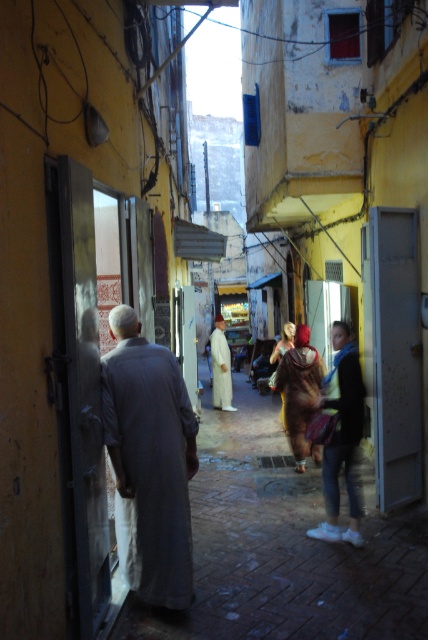
Is gray cotton robe at left taller than denim jeans at center?

Yes, gray cotton robe at left is taller than denim jeans at center.

Does point (146, 513) come in front of point (336, 396)?

Yes.

Locate an element on the screen. The width and height of the screenshot is (428, 640). gray cotton robe at left is located at coordinates (148, 461).

Identify the location of gray cotton robe at left. The image size is (428, 640). (148, 461).

Is gray cotton robe at left to the left of white cotton robe at center from the viewer's perspective?

Correct, you'll find gray cotton robe at left to the left of white cotton robe at center.

Is point (184, 524) in front of point (228, 394)?

Yes, it is in front of point (228, 394).

Locate an element on the screen. gray cotton robe at left is located at coordinates (148, 461).

Is the position of denim jeans at center more distant than that of white cotton robe at center?

That is False.

Who is more distant from viewer, (309,422) or (220,317)?

Point (220,317)

Locate an element on the screen. This screenshot has height=640, width=428. denim jeans at center is located at coordinates (341, 436).